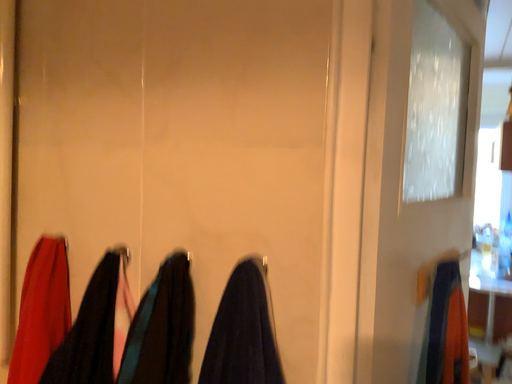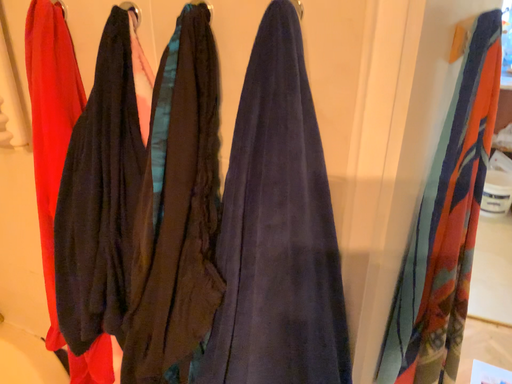
Question: Which way did the camera rotate in the video?

Choices:
 (A) rotated upward
 (B) rotated downward

Answer: (B)